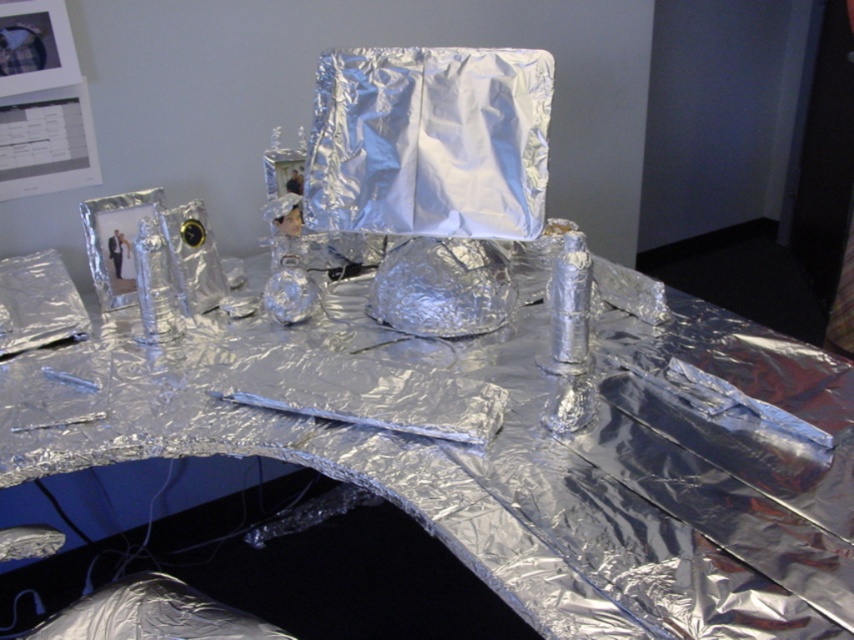
You are a guest at a dinner party and notice the shiny metallic table at center and the shiny metallic wrap at center. Which object is positioned lower in the scene?

The shiny metallic table at center is positioned lower than the shiny metallic wrap at center.

You are standing in front of the table covered in aluminum foil and see two points marked on it. Which of the two points, point (149,394) or point (340,129), is closer to you?

Point (149,394) is closer to the viewer than point (340,129).

You are a delivery person who needs to place a package on the table. The package is 40 centimeters wide. Can you fit it between the shiny metallic table at center and the shiny metallic wrap at center without overlapping either?

The distance between the shiny metallic table at center and the shiny metallic wrap at center is 42.84 centimeters. Since the package is 40 centimeters wide, it can fit between them without overlapping as there is enough space.